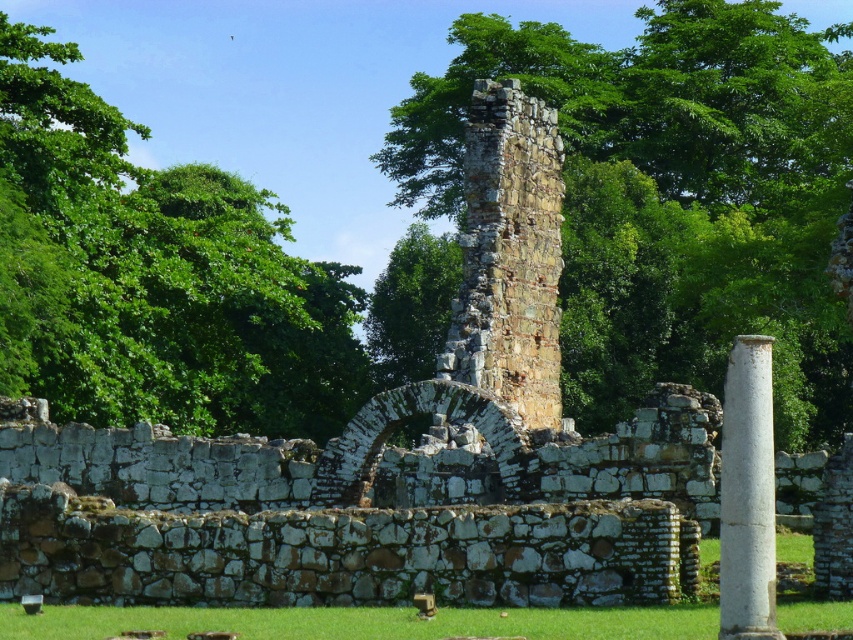
The width and height of the screenshot is (853, 640). I want to click on green leafy tree at left, so click(154, 276).

Where is `green leafy tree at left`? The width and height of the screenshot is (853, 640). green leafy tree at left is located at coordinates (154, 276).

The height and width of the screenshot is (640, 853). What do you see at coordinates (672, 196) in the screenshot?
I see `green leafy tree at center` at bounding box center [672, 196].

Does green leafy tree at center have a larger size compared to green grass at lower center?

Indeed, green leafy tree at center has a larger size compared to green grass at lower center.

Is point (532, 88) in front of point (16, 614)?

That is False.

Where is `green leafy tree at center`? green leafy tree at center is located at coordinates (672, 196).

Is green leafy tree at center thinner than white stone column at right?

Incorrect, green leafy tree at center's width is not less than white stone column at right's.

Is green leafy tree at center to the right of white stone column at right from the viewer's perspective?

Indeed, green leafy tree at center is positioned on the right side of white stone column at right.

Find the location of a particular element. The width and height of the screenshot is (853, 640). green leafy tree at center is located at coordinates (672, 196).